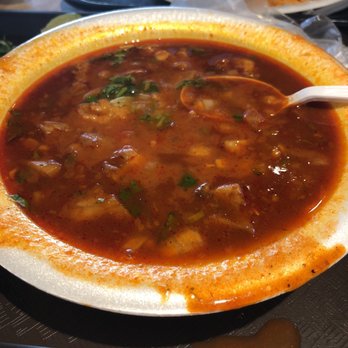
Where is `white lines on table`? The width and height of the screenshot is (348, 348). white lines on table is located at coordinates (31, 327), (51, 333), (10, 320).